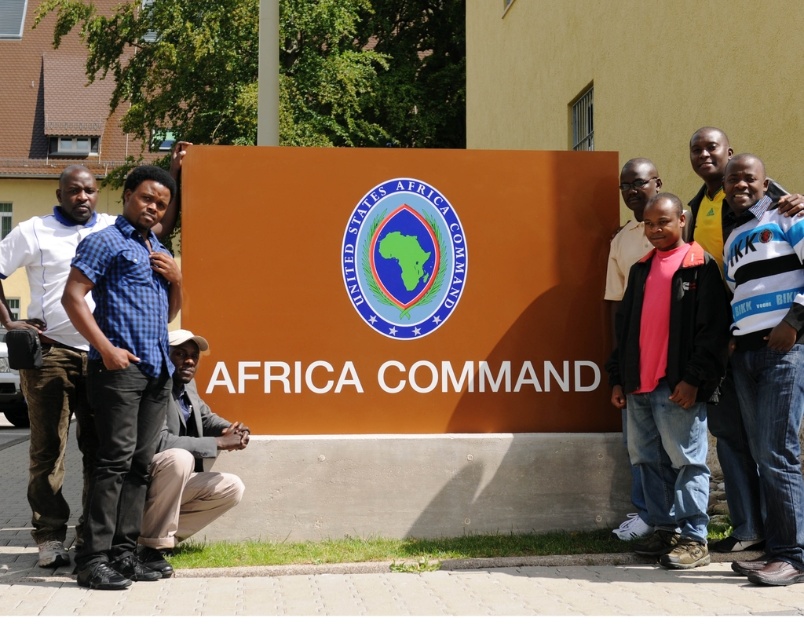
Which is in front, point (43, 365) or point (718, 188)?

Positioned in front is point (43, 365).

Which is behind, point (31, 388) or point (714, 422)?

Positioned behind is point (714, 422).

Find the location of `blue checkered shirt at left`. blue checkered shirt at left is located at coordinates (52, 353).

Does striped jersey at right have a greater width compared to pink fabric shirt at right?

No.

At what (x,y) coordinates should I click in order to perform the action: click on striped jersey at right. Please return your answer as a coordinate pair (x, y). The width and height of the screenshot is (804, 640). Looking at the image, I should click on (735, 476).

Identify the location of striped jersey at right. (735, 476).

Who is shorter, orange matte sign at center or striped jersey at right?

striped jersey at right is shorter.

Does orange matte sign at center have a lesser height compared to striped jersey at right?

In fact, orange matte sign at center may be taller than striped jersey at right.

The width and height of the screenshot is (804, 640). What do you see at coordinates (400, 285) in the screenshot?
I see `orange matte sign at center` at bounding box center [400, 285].

Find the location of `orange matte sign at center`. orange matte sign at center is located at coordinates (400, 285).